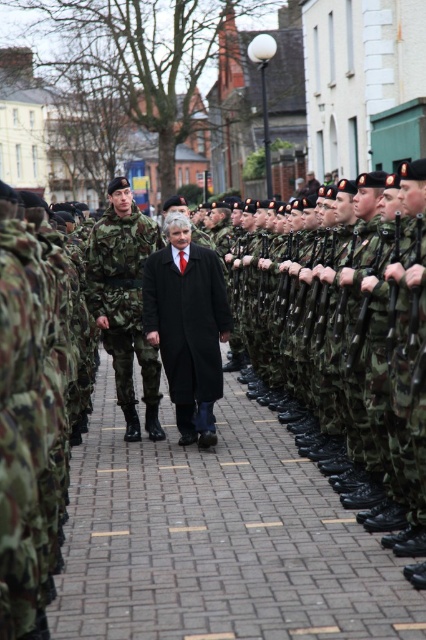
Which is below, brick pavement at center or black wool coat at center?

brick pavement at center is below.

Can you confirm if brick pavement at center is positioned to the left of black wool coat at center?

In fact, brick pavement at center is to the right of black wool coat at center.

What do you see at coordinates (218, 538) in the screenshot? I see `brick pavement at center` at bounding box center [218, 538].

The image size is (426, 640). What are the coordinates of `brick pavement at center` in the screenshot? It's located at (218, 538).

Can you confirm if camouflage uniform at center is positioned above black wool coat at center?

Yes, camouflage uniform at center is above black wool coat at center.

Who is shorter, camouflage uniform at center or black wool coat at center?

Standing shorter between the two is black wool coat at center.

Does point (143, 260) come closer to viewer compared to point (189, 266)?

No, it is behind (189, 266).

Where is `camouflage uniform at center`? Image resolution: width=426 pixels, height=640 pixels. camouflage uniform at center is located at coordinates (124, 301).

Is brick pavement at center bigger than camouflage uniform at center?

Incorrect, brick pavement at center is not larger than camouflage uniform at center.

Find the location of `brick pavement at center`. brick pavement at center is located at coordinates (218, 538).

I want to click on brick pavement at center, so click(218, 538).